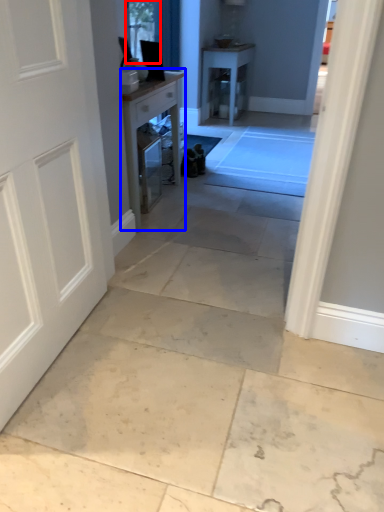
Question: Which object is further to the camera taking this photo, window screen (highlighted by a red box) or table (highlighted by a blue box)?

Choices:
 (A) window screen
 (B) table

Answer: (A)